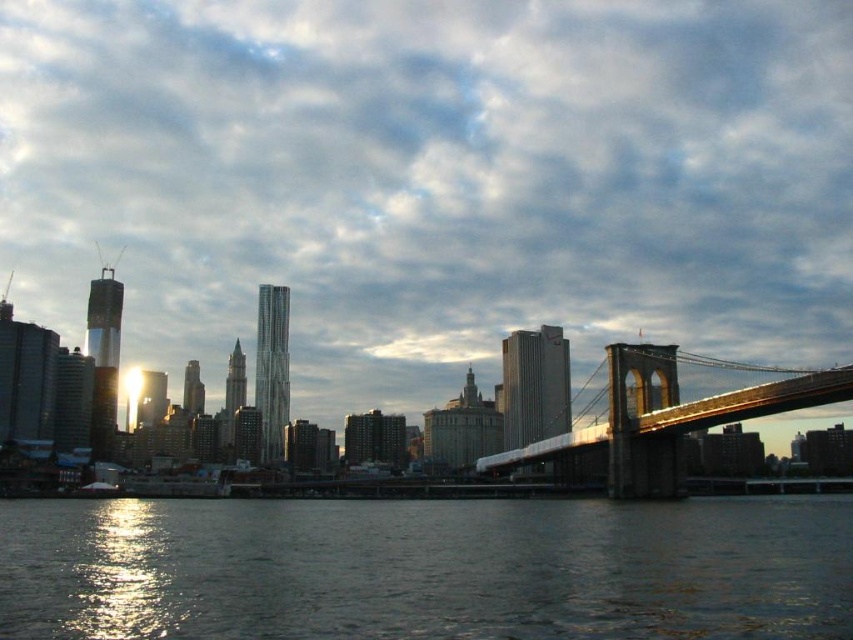
Question: Which of these objects is positioned closest to the cloudy sky at upper center?

Choices:
 (A) dark water at lower center
 (B) metallic brown bridge at right

Answer: (B)

Question: Is dark water at lower center thinner than metallic brown bridge at right?

Choices:
 (A) no
 (B) yes

Answer: (A)

Question: Can you confirm if cloudy sky at upper center is positioned above dark water at lower center?

Choices:
 (A) yes
 (B) no

Answer: (A)

Question: Among these points, which one is farthest from the camera?

Choices:
 (A) (305, 19)
 (B) (422, 627)
 (C) (677, 401)

Answer: (A)

Question: Is cloudy sky at upper center further to camera compared to metallic brown bridge at right?

Choices:
 (A) yes
 (B) no

Answer: (A)

Question: Which object is farther from the camera taking this photo?

Choices:
 (A) cloudy sky at upper center
 (B) dark water at lower center
 (C) metallic brown bridge at right

Answer: (A)